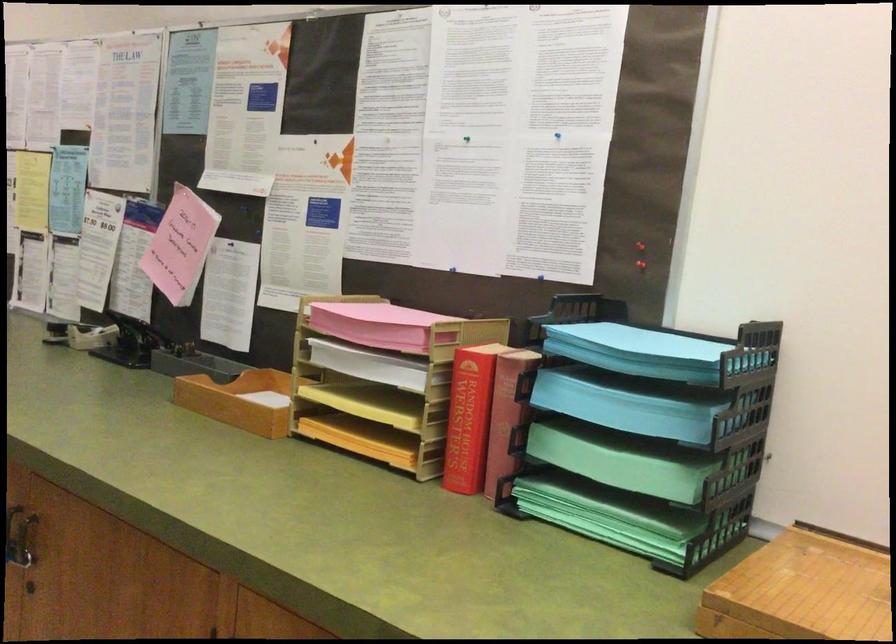
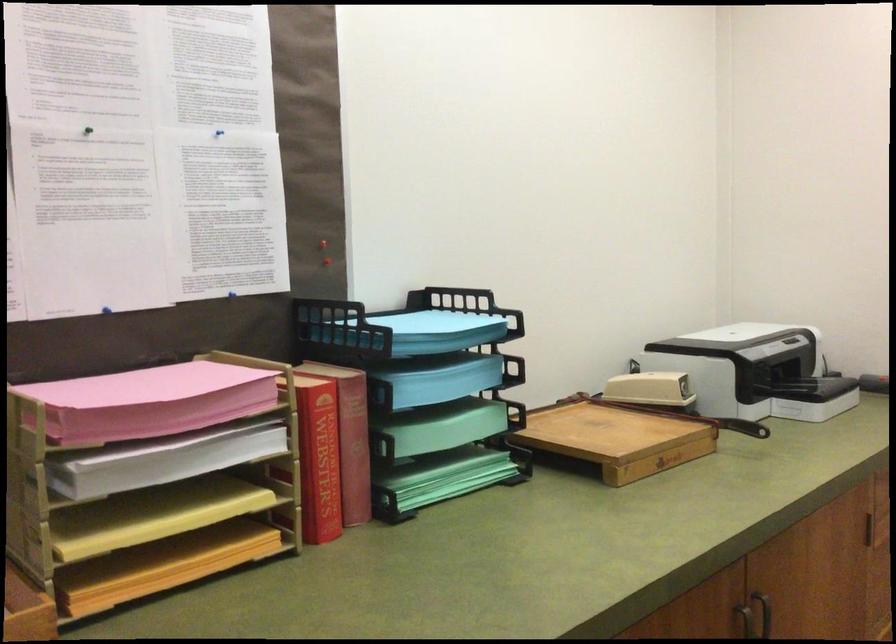
Question: I am providing you with two images of the same scene from different viewpoints. Which of the following objects are not visible in image2?

Choices:
 (A) white paper stack
 (B) dark cabinet handle
 (C) black cutter handle
 (D) none of these

Answer: (D)